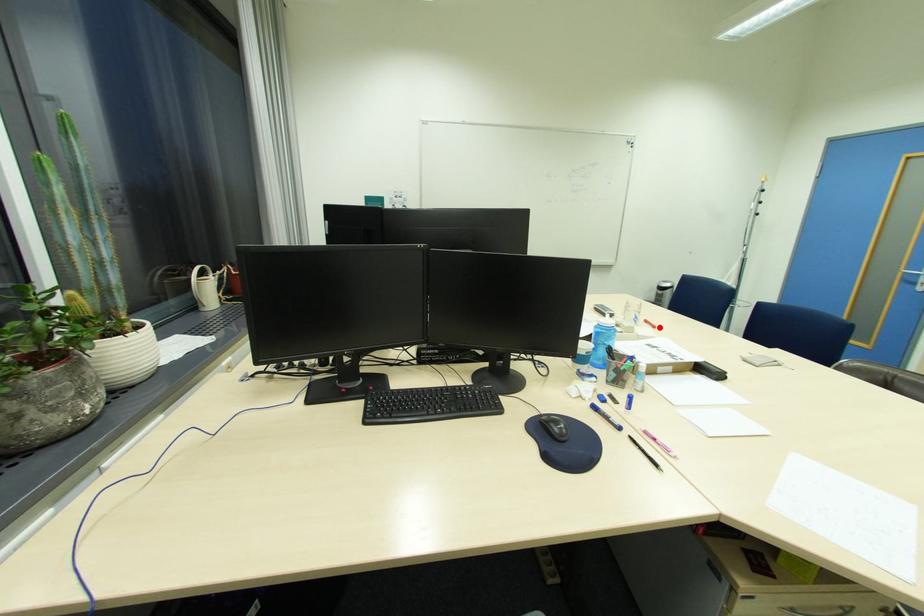
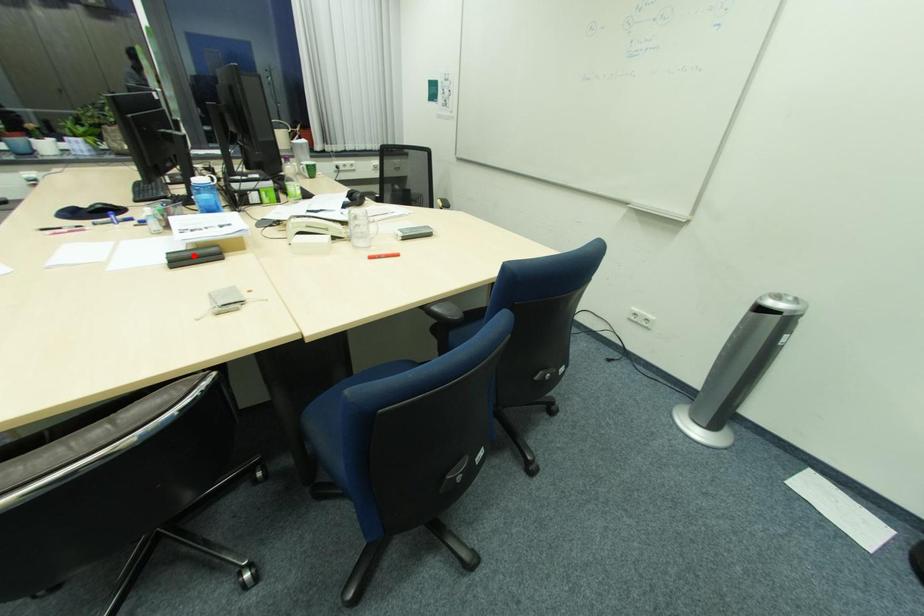
I am providing you with two images of the same scene from different viewpoints. A red point is marked on the first image and another point is marked on the second image. Are the points marked in image1 and image2 representing the same 3D position?

No